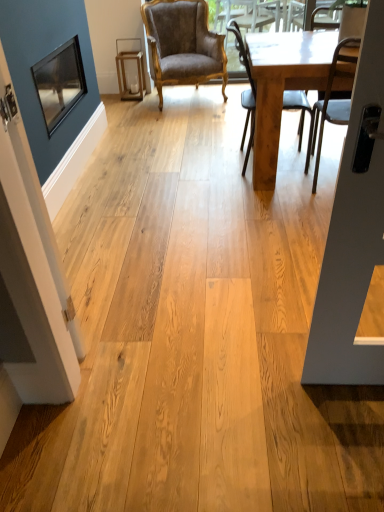
At what (x,y) coordinates should I click in order to perform the action: click on free space in front of light brown wooden table at right. Please return your answer as a coordinate pair (x, y). Looking at the image, I should click on (267, 223).